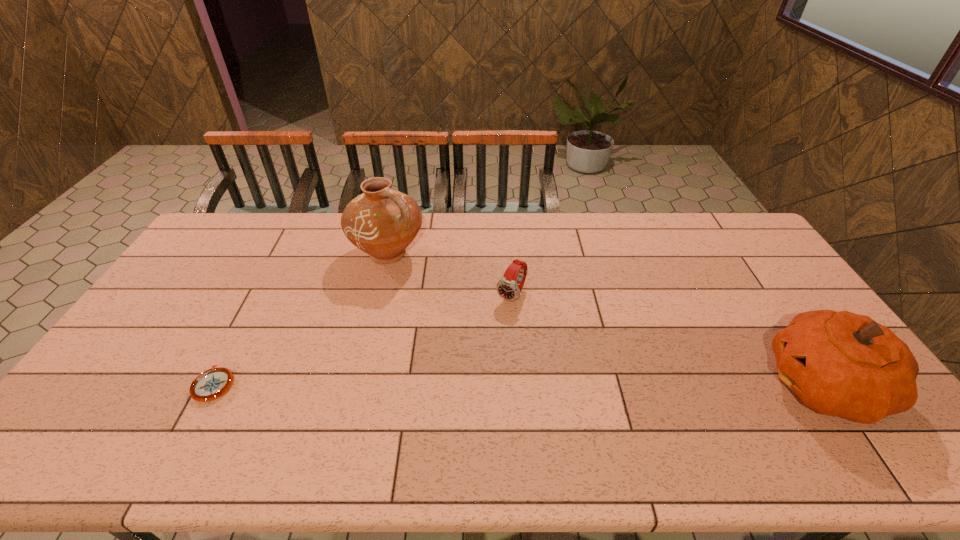
At what (x,y) coordinates should I click in order to perform the action: click on blank area located on the front-facing side of the rightmost object. Please return your answer as a coordinate pair (x, y). The height and width of the screenshot is (540, 960). Looking at the image, I should click on (742, 384).

Where is `vacant area located 0.330m on the front-facing side of the rightmost object`? vacant area located 0.330m on the front-facing side of the rightmost object is located at coordinates pyautogui.click(x=639, y=384).

Locate an element on the screen. The image size is (960, 540). free location located on the face of the watch is located at coordinates (482, 341).

The width and height of the screenshot is (960, 540). I want to click on free space located 0.130m on the face of the watch, so click(x=485, y=336).

Locate an element on the screen. The height and width of the screenshot is (540, 960). vacant position located on the face of the watch is located at coordinates (443, 397).

Locate an element on the screen. vacant space located on the side of the farthest object with the handle is located at coordinates (461, 307).

At what (x,y) coordinates should I click in order to perform the action: click on vacant space located 0.150m on the side of the farthest object with the handle. Please return your answer as a coordinate pair (x, y). Looking at the image, I should click on (442, 292).

Identify the location of vacant space situated 0.190m on the side of the farthest object with the handle. The width and height of the screenshot is (960, 540). (450, 299).

Where is `object that is positioned at the far edge`? object that is positioned at the far edge is located at coordinates (382, 222).

Image resolution: width=960 pixels, height=540 pixels. I want to click on compass that is at the near edge, so click(213, 383).